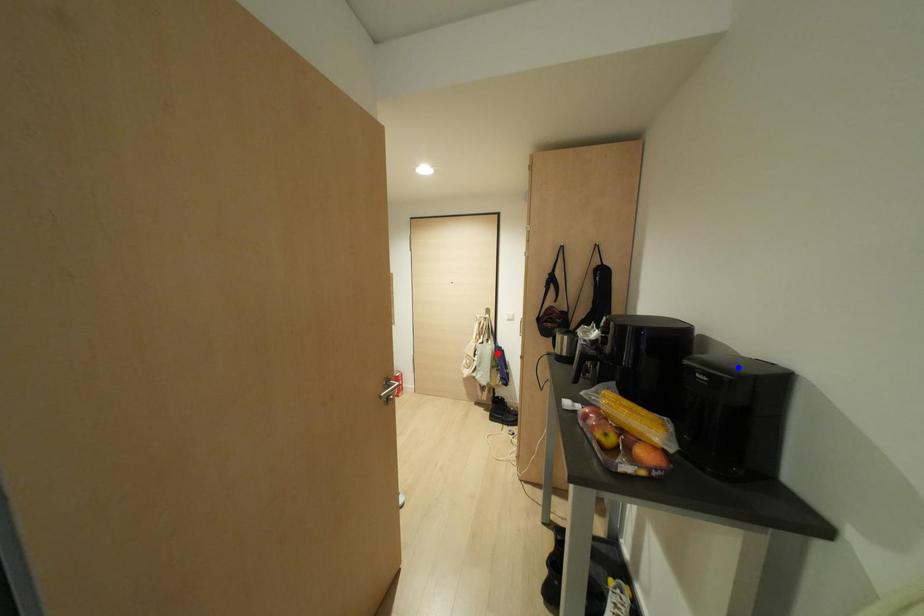
Question: In the image, two points are highlighted. Which point is nearer to the camera? Reply with the corresponding letter.

Choices:
 (A) blue point
 (B) red point

Answer: (A)